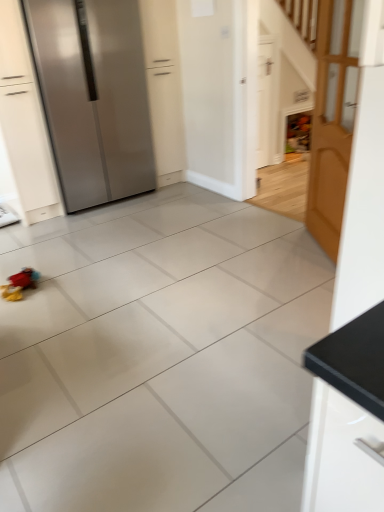
At what (x,y) coordinates should I click in order to perform the action: click on satin silver refrigerator at left. Please return your answer as a coordinate pair (x, y). The image size is (384, 512). Looking at the image, I should click on (93, 97).

Measure the distance between point (322,206) and camera.

Point (322,206) and camera are 9.11 feet apart from each other.

Find the location of a particular element. This screenshot has width=384, height=512. wooden door at right, the second door in the back-to-front sequence is located at coordinates (333, 119).

Find the location of a particular element. Image resolution: width=384 pixels, height=512 pixels. satin silver refrigerator at left is located at coordinates (93, 97).

From a real-world perspective, which object stands above the other?

satin silver refrigerator at left, from a real-world perspective.

Is satin silver refrigerator at left far from plush multicolored toy at lower left?

satin silver refrigerator at left is positioned a significant distance from plush multicolored toy at lower left.

Between satin silver refrigerator at left and plush multicolored toy at lower left, which one has smaller size?

plush multicolored toy at lower left is smaller.

Does satin silver refrigerator at left come in front of plush multicolored toy at lower left?

No.

Is there a large distance between satin silver refrigerator at left and wooden door at right, the second door in the back-to-front sequence?

Yes.

Is satin silver refrigerator at left thinner than wooden door at right, the 1th door viewed from the front?

No.

From a real-world perspective, is satin silver refrigerator at left positioned over wooden door at right, the second door in the back-to-front sequence, based on gravity?

Yes, from a real-world perspective, satin silver refrigerator at left is over wooden door at right, the second door in the back-to-front sequence

Is satin silver refrigerator at left further to camera compared to wooden door at right, the 1th door viewed from the front?

Yes, it is behind wooden door at right, the 1th door viewed from the front.

Who is bigger, plush multicolored toy at lower left or white matte door at upper right, which appears as the 1th door when viewed from the back?

white matte door at upper right, which appears as the 1th door when viewed from the back.

Is plush multicolored toy at lower left outside of white matte door at upper right, which is the second door in front-to-back order?

Yes.

Consider the image. How far apart are plush multicolored toy at lower left and white matte door at upper right, which is the second door in front-to-back order?

2.87 meters.

From a real-world perspective, does plush multicolored toy at lower left sit lower than white matte door at upper right, which is the second door in front-to-back order?

Yes, from a real-world perspective, plush multicolored toy at lower left is beneath white matte door at upper right, which is the second door in front-to-back order.

From the image's perspective, which is below, plush multicolored toy at lower left or satin silver refrigerator at left?

plush multicolored toy at lower left is shown below in the image.

Is plush multicolored toy at lower left oriented towards satin silver refrigerator at left?

No.

Is plush multicolored toy at lower left beside satin silver refrigerator at left?

No, plush multicolored toy at lower left is not next to satin silver refrigerator at left.

Considering the relative positions of plush multicolored toy at lower left and satin silver refrigerator at left in the image provided, is plush multicolored toy at lower left to the left of satin silver refrigerator at left from the viewer's perspective?

Correct, you'll find plush multicolored toy at lower left to the left of satin silver refrigerator at left.

Considering the relative sizes of wooden door at right, the second door in the back-to-front sequence, and satin silver refrigerator at left in the image provided, is wooden door at right, the second door in the back-to-front sequence, taller than satin silver refrigerator at left?

No.

How far apart are wooden door at right, the second door in the back-to-front sequence, and satin silver refrigerator at left?

wooden door at right, the second door in the back-to-front sequence, is 5.83 feet from satin silver refrigerator at left.

Based on the photo, considering the relative sizes of wooden door at right, the second door in the back-to-front sequence, and satin silver refrigerator at left in the image provided, is wooden door at right, the second door in the back-to-front sequence, wider than satin silver refrigerator at left?

In fact, wooden door at right, the second door in the back-to-front sequence, might be narrower than satin silver refrigerator at left.

Identify the location of refrigerator above the wooden door at right, the second door in the back-to-front sequence (from the image's perspective). The height and width of the screenshot is (512, 384). (93, 97).

Does plush multicolored toy at lower left turn towards wooden door at right, the 1th door viewed from the front?

No, plush multicolored toy at lower left is not turned towards wooden door at right, the 1th door viewed from the front.

From the image's perspective, would you say plush multicolored toy at lower left is shown under wooden door at right, the 1th door viewed from the front?

Indeed, from the image's perspective, plush multicolored toy at lower left is shown beneath wooden door at right, the 1th door viewed from the front.

Does point (18, 291) appear closer or farther from the camera than point (345, 21)?

Point (18, 291) is farther from the camera than point (345, 21).

Between plush multicolored toy at lower left and wooden door at right, the second door in the back-to-front sequence, which one appears on the right side from the viewer's perspective?

wooden door at right, the second door in the back-to-front sequence, is more to the right.

Is plush multicolored toy at lower left completely or partially inside wooden door at right, the second door in the back-to-front sequence?

No, plush multicolored toy at lower left is not inside wooden door at right, the second door in the back-to-front sequence.

Can you tell me how much wooden door at right, the second door in the back-to-front sequence, and plush multicolored toy at lower left differ in facing direction?

The angle between the facing direction of wooden door at right, the second door in the back-to-front sequence, and the facing direction of plush multicolored toy at lower left is 149 degrees.

Considering the relative sizes of wooden door at right, the second door in the back-to-front sequence, and plush multicolored toy at lower left in the image provided, is wooden door at right, the second door in the back-to-front sequence, wider than plush multicolored toy at lower left?

No.

Does wooden door at right, the 1th door viewed from the front, have a greater height compared to plush multicolored toy at lower left?

Indeed, wooden door at right, the 1th door viewed from the front, has a greater height compared to plush multicolored toy at lower left.

Where is `toy below the satin silver refrigerator at left (from the image's perspective)`? The width and height of the screenshot is (384, 512). toy below the satin silver refrigerator at left (from the image's perspective) is located at coordinates (19, 284).

Where is `door in front of the satin silver refrigerator at left`? door in front of the satin silver refrigerator at left is located at coordinates click(x=333, y=119).

Looking at the image, which one is located further to satin silver refrigerator at left, wooden door at right, the second door in the back-to-front sequence, or white matte door at upper right, which appears as the 1th door when viewed from the back?

wooden door at right, the second door in the back-to-front sequence, is positioned further to the anchor satin silver refrigerator at left.

Considering their positions, is white matte door at upper right, which is the second door in front-to-back order, positioned further to satin silver refrigerator at left than wooden door at right, the second door in the back-to-front sequence?

wooden door at right, the second door in the back-to-front sequence, is further to satin silver refrigerator at left.

Estimate the real-world distances between objects in this image. Which object is closer to wooden door at right, the second door in the back-to-front sequence, satin silver refrigerator at left or white matte door at upper right, which appears as the 1th door when viewed from the back?

white matte door at upper right, which appears as the 1th door when viewed from the back, is positioned closer to the anchor wooden door at right, the second door in the back-to-front sequence.

Looking at the image, which one is located further to white matte door at upper right, which appears as the 1th door when viewed from the back, satin silver refrigerator at left or plush multicolored toy at lower left?

plush multicolored toy at lower left is positioned further to the anchor white matte door at upper right, which appears as the 1th door when viewed from the back.

Considering their positions, is plush multicolored toy at lower left positioned closer to satin silver refrigerator at left than wooden door at right, the second door in the back-to-front sequence?

plush multicolored toy at lower left is closer to satin silver refrigerator at left.

Which object lies further to the anchor point white matte door at upper right, which is the second door in front-to-back order, wooden door at right, the 1th door viewed from the front, or plush multicolored toy at lower left?

plush multicolored toy at lower left is further to white matte door at upper right, which is the second door in front-to-back order.

Consider the image. Based on their spatial positions, is white matte door at upper right, which appears as the 1th door when viewed from the back, or plush multicolored toy at lower left closer to satin silver refrigerator at left?

plush multicolored toy at lower left is positioned closer to the anchor satin silver refrigerator at left.

Estimate the real-world distances between objects in this image. Which object is closer to wooden door at right, the 1th door viewed from the front, plush multicolored toy at lower left or satin silver refrigerator at left?

Based on the image, satin silver refrigerator at left appears to be nearer to wooden door at right, the 1th door viewed from the front.

At what (x,y) coordinates should I click in order to perform the action: click on refrigerator situated between plush multicolored toy at lower left and white matte door at upper right, which appears as the 1th door when viewed from the back, from left to right. Please return your answer as a coordinate pair (x, y). The image size is (384, 512). Looking at the image, I should click on (93, 97).

Identify the location of refrigerator between plush multicolored toy at lower left and wooden door at right, the 1th door viewed from the front, in the horizontal direction. This screenshot has height=512, width=384. (93, 97).

You are a GUI agent. You are given a task and a screenshot of the screen. Output one action in this format:
    pyautogui.click(x=<x>, y=<y>)
    Task: Click on the refrigerator positioned between wooden door at right, the 1th door viewed from the front, and white matte door at upper right, which is the second door in front-to-back order, from near to far
    This screenshot has height=512, width=384.
    Given the screenshot: What is the action you would take?
    pyautogui.click(x=93, y=97)

The image size is (384, 512). In order to click on door between plush multicolored toy at lower left and wooden door at right, the 1th door viewed from the front in this screenshot , I will do `click(267, 98)`.